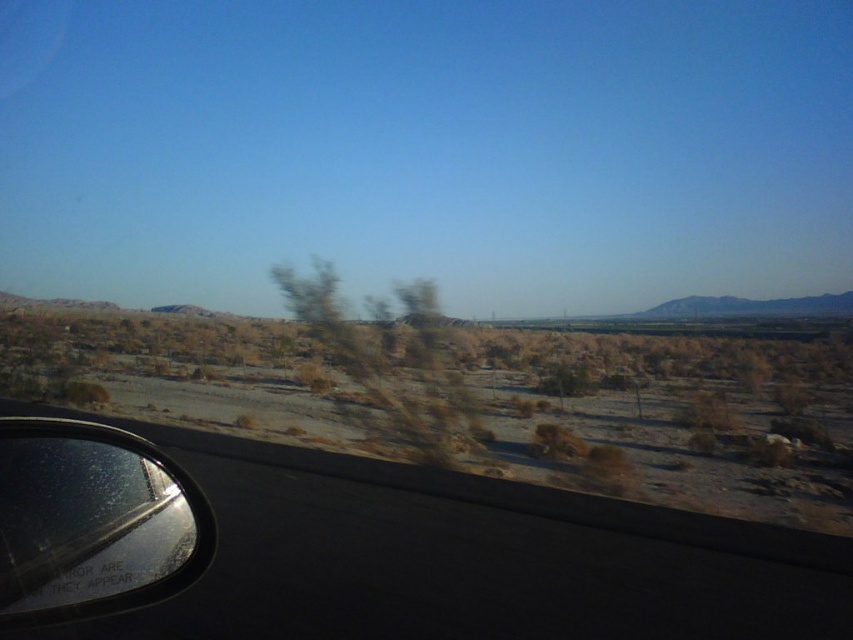
Question: Is brown sandy desert at lower left below glossy plastic view mirror at lower left?

Choices:
 (A) no
 (B) yes

Answer: (A)

Question: Which point is closer to the camera?

Choices:
 (A) brown sandy desert at lower left
 (B) glossy plastic view mirror at lower left

Answer: (B)

Question: Which point is closer to the camera?

Choices:
 (A) brown sandy desert at lower left
 (B) glossy plastic view mirror at lower left

Answer: (B)

Question: Does brown sandy desert at lower left lie behind glossy plastic view mirror at lower left?

Choices:
 (A) no
 (B) yes

Answer: (B)

Question: Is brown sandy desert at lower left above glossy plastic view mirror at lower left?

Choices:
 (A) yes
 (B) no

Answer: (A)